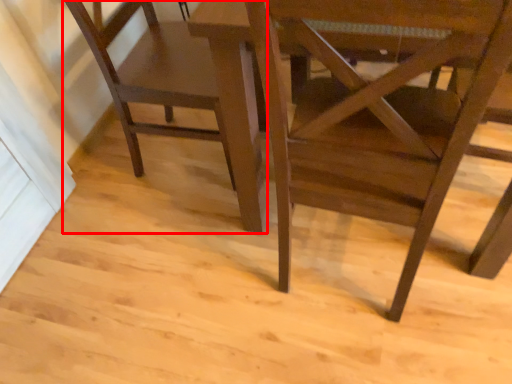
Question: From the image's perspective, where is chair (annotated by the red box) located relative to chair?

Choices:
 (A) below
 (B) above

Answer: (B)